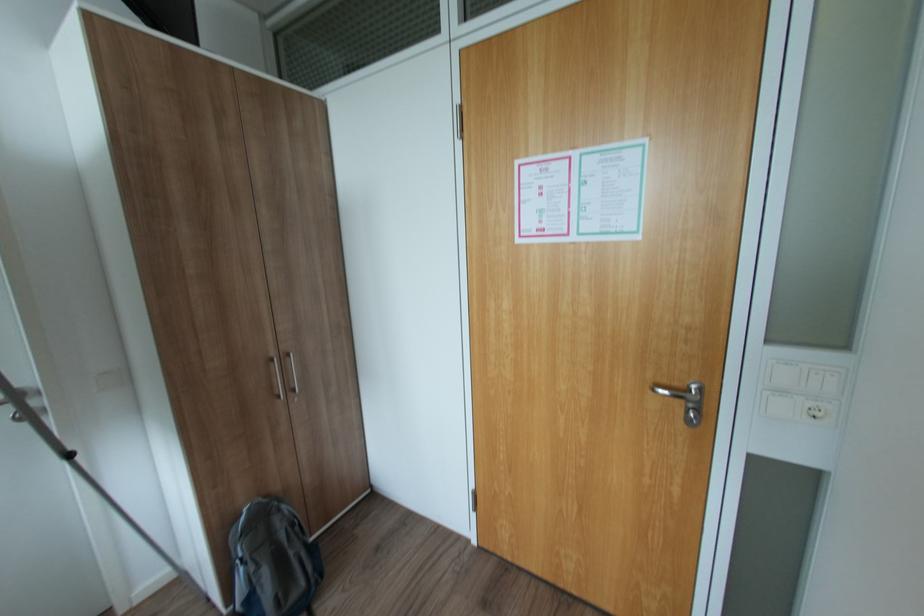
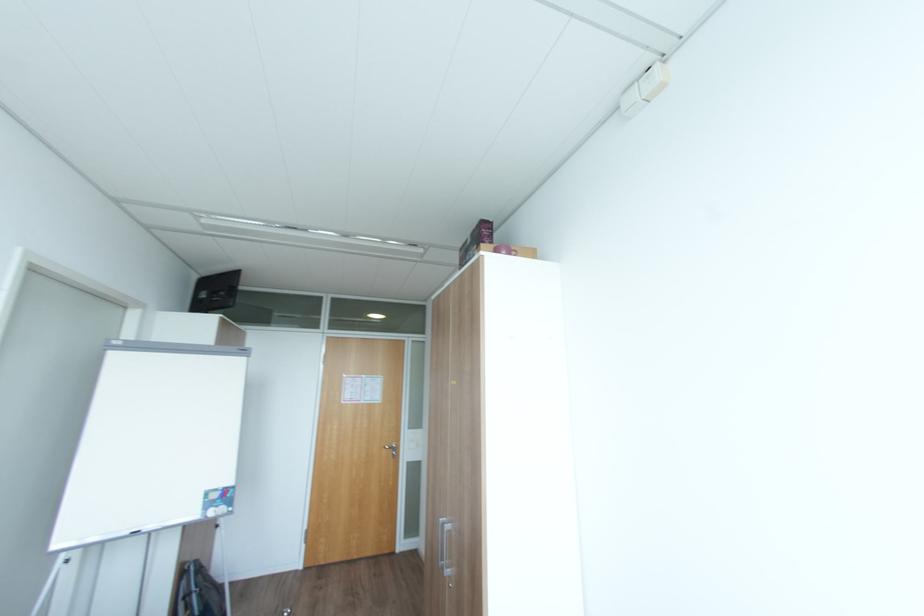
Locate, in the second image, the point that corresponds to pixel 664 390 in the first image.

(392, 448)